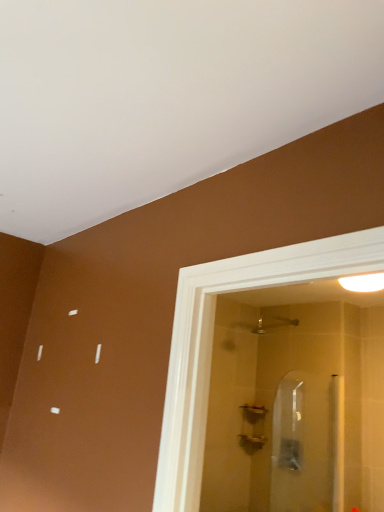
Question: Is matte silver showerhead at upper center turned away from white glossy light fixture at upper right?

Choices:
 (A) no
 (B) yes

Answer: (A)

Question: Is matte silver showerhead at upper center taller than white glossy light fixture at upper right?

Choices:
 (A) no
 (B) yes

Answer: (B)

Question: Does matte silver showerhead at upper center contain white glossy light fixture at upper right?

Choices:
 (A) yes
 (B) no

Answer: (B)

Question: Is matte silver showerhead at upper center further to the viewer compared to white glossy light fixture at upper right?

Choices:
 (A) yes
 (B) no

Answer: (A)

Question: From the image's perspective, is matte silver showerhead at upper center located beneath white glossy light fixture at upper right?

Choices:
 (A) no
 (B) yes

Answer: (B)

Question: Looking at their shapes, would you say white glossy light fixture at upper right is wider or thinner than clear glass screen door at center?

Choices:
 (A) thin
 (B) wide

Answer: (B)

Question: In terms of size, does white glossy light fixture at upper right appear bigger or smaller than clear glass screen door at center?

Choices:
 (A) big
 (B) small

Answer: (B)

Question: From a real-world perspective, is white glossy light fixture at upper right above or below clear glass screen door at center?

Choices:
 (A) below
 (B) above

Answer: (B)

Question: From the image's perspective, is white glossy light fixture at upper right located above or below clear glass screen door at center?

Choices:
 (A) below
 (B) above

Answer: (B)

Question: From a real-world perspective, relative to matte silver showerhead at upper center, is clear glass screen door at center vertically above or below?

Choices:
 (A) above
 (B) below

Answer: (B)

Question: Considering the relative positions of clear glass screen door at center and matte silver showerhead at upper center in the image provided, is clear glass screen door at center to the left or to the right of matte silver showerhead at upper center?

Choices:
 (A) left
 (B) right

Answer: (B)

Question: Is point (291, 376) positioned closer to the camera than point (251, 327)?

Choices:
 (A) farther
 (B) closer

Answer: (B)

Question: In terms of height, does clear glass screen door at center look taller or shorter compared to matte silver showerhead at upper center?

Choices:
 (A) short
 (B) tall

Answer: (B)

Question: From the image's perspective, is matte silver showerhead at upper center positioned above or below clear glass screen door at center?

Choices:
 (A) above
 (B) below

Answer: (A)

Question: Is matte silver showerhead at upper center bigger or smaller than clear glass screen door at center?

Choices:
 (A) small
 (B) big

Answer: (A)